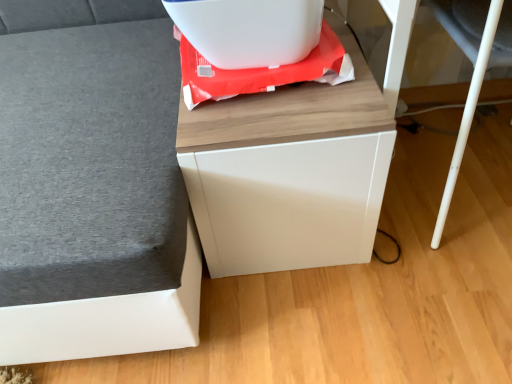
This screenshot has width=512, height=384. I want to click on matte gray sofa at left, the first furniture positioned from the left, so click(x=92, y=184).

Where is `white glossy cabinet at center, which appears as the second furniture when viewed from the left`? Image resolution: width=512 pixels, height=384 pixels. white glossy cabinet at center, which appears as the second furniture when viewed from the left is located at coordinates (289, 172).

This screenshot has width=512, height=384. What are the coordinates of `white plastic swivel chair at lower right` in the screenshot? It's located at (467, 116).

Describe the element at coordinates (249, 30) in the screenshot. This screenshot has width=512, height=384. I see `white plastic container at upper center` at that location.

I want to click on matte gray sofa at left, the first furniture positioned from the left, so click(x=92, y=184).

Is white plastic container at upper center a part of matte gray sofa at left, the first furniture positioned from the left?

No.

From a real-world perspective, is matte gray sofa at left, the first furniture positioned from the left, located higher than white plastic container at upper center?

Incorrect, from a real-world perspective, matte gray sofa at left, the first furniture positioned from the left, is lower than white plastic container at upper center.

Who is bigger, matte gray sofa at left, the second furniture positioned from the right, or white plastic container at upper center?

matte gray sofa at left, the second furniture positioned from the right, is bigger.

Find the location of a particular element. The width and height of the screenshot is (512, 384). appliance above the matte gray sofa at left, the first furniture positioned from the left (from a real-world perspective) is located at coordinates (249, 30).

How distant is white plastic swivel chair at lower right from matte gray sofa at left, the second furniture positioned from the right?

A distance of 29.80 inches exists between white plastic swivel chair at lower right and matte gray sofa at left, the second furniture positioned from the right.

Is white plastic swivel chair at lower right touching matte gray sofa at left, the second furniture positioned from the right?

white plastic swivel chair at lower right and matte gray sofa at left, the second furniture positioned from the right, are not in contact.

Between white plastic swivel chair at lower right and matte gray sofa at left, the second furniture positioned from the right, which one has more height?

matte gray sofa at left, the second furniture positioned from the right, is taller.

Considering their positions, is white plastic swivel chair at lower right located in front of or behind matte gray sofa at left, the first furniture positioned from the left?

white plastic swivel chair at lower right is positioned farther from the viewer than matte gray sofa at left, the first furniture positioned from the left.

Is white glossy cabinet at center, arranged as the first furniture when viewed from the right, next to white plastic swivel chair at lower right?

No, white glossy cabinet at center, arranged as the first furniture when viewed from the right, is not beside white plastic swivel chair at lower right.

Is white glossy cabinet at center, which appears as the second furniture when viewed from the left, behind white plastic swivel chair at lower right?

Yes.

Could you tell me if white glossy cabinet at center, which appears as the second furniture when viewed from the left, is facing white plastic swivel chair at lower right?

No, white glossy cabinet at center, which appears as the second furniture when viewed from the left, does not turn towards white plastic swivel chair at lower right.

Which is in front, white plastic container at upper center or white plastic swivel chair at lower right?

white plastic swivel chair at lower right is more forward.

Would you say white plastic container at upper center is outside white plastic swivel chair at lower right?

Yes, white plastic container at upper center is located beyond the bounds of white plastic swivel chair at lower right.

Is white plastic container at upper center smaller than white plastic swivel chair at lower right?

Yes.

Is white plastic container at upper center aimed at white plastic swivel chair at lower right?

No.

Is white glossy cabinet at center, arranged as the first furniture when viewed from the right, facing towards white plastic container at upper center?

No.

Considering the points (317, 97) and (290, 51), which point is behind, point (317, 97) or point (290, 51)?

Point (290, 51)

Measure the distance from white glossy cabinet at center, arranged as the first furniture when viewed from the right, to white plastic container at upper center.

white glossy cabinet at center, arranged as the first furniture when viewed from the right, and white plastic container at upper center are 8.90 inches apart.

How many degrees apart are the facing directions of white glossy cabinet at center, which appears as the second furniture when viewed from the left, and white plastic container at upper center?

white glossy cabinet at center, which appears as the second furniture when viewed from the left, and white plastic container at upper center are facing 93.6 degrees away from each other.

From the white plastic container at upper center, count 1st furnitures forward and point to it. Please provide its 2D coordinates.

[(289, 172)]

Between white plastic container at upper center and white glossy cabinet at center, arranged as the first furniture when viewed from the right, which one has smaller width?

white plastic container at upper center is thinner.

Is white plastic container at upper center oriented towards white glossy cabinet at center, which appears as the second furniture when viewed from the left?

No, white plastic container at upper center is not facing towards white glossy cabinet at center, which appears as the second furniture when viewed from the left.

From a real-world perspective, who is located higher, white plastic container at upper center or white glossy cabinet at center, which appears as the second furniture when viewed from the left?

white plastic container at upper center is physically above.

Is white plastic container at upper center facing towards matte gray sofa at left, the second furniture positioned from the right?

Yes, white plastic container at upper center is facing matte gray sofa at left, the second furniture positioned from the right.

Is white plastic container at upper center directly adjacent to matte gray sofa at left, the first furniture positioned from the left?

No.

You are a GUI agent. You are given a task and a screenshot of the screen. Output one action in this format:
    pyautogui.click(x=<x>, y=<y>)
    Task: Click on the appliance lying behind the matte gray sofa at left, the first furniture positioned from the left
    The width and height of the screenshot is (512, 384).
    Given the screenshot: What is the action you would take?
    pyautogui.click(x=249, y=30)

From a real-world perspective, starting from the white plastic container at upper center, which furniture is the 1st one below it? Please provide its 2D coordinates.

[(92, 184)]

Identify the location of the 2nd furniture counting from the left of the white plastic swivel chair at lower right. The width and height of the screenshot is (512, 384). (92, 184).

Looking at the image, which one is located further to white glossy cabinet at center, arranged as the first furniture when viewed from the right, white plastic swivel chair at lower right or white plastic container at upper center?

white plastic swivel chair at lower right is further to white glossy cabinet at center, arranged as the first furniture when viewed from the right.

Considering their positions, is matte gray sofa at left, the second furniture positioned from the right, positioned further to white plastic container at upper center than white plastic swivel chair at lower right?

white plastic swivel chair at lower right lies further to white plastic container at upper center than the other object.

Considering their positions, is white plastic container at upper center positioned closer to matte gray sofa at left, the first furniture positioned from the left, than white plastic swivel chair at lower right?

Based on the image, white plastic container at upper center appears to be nearer to matte gray sofa at left, the first furniture positioned from the left.

From the image, which object appears to be farther from white plastic container at upper center, matte gray sofa at left, the first furniture positioned from the left, or white glossy cabinet at center, arranged as the first furniture when viewed from the right?

matte gray sofa at left, the first furniture positioned from the left, lies further to white plastic container at upper center than the other object.

Looking at this image, looking at the image, which one is located closer to white glossy cabinet at center, which appears as the second furniture when viewed from the left, white plastic swivel chair at lower right or matte gray sofa at left, the first furniture positioned from the left?

Based on the image, matte gray sofa at left, the first furniture positioned from the left, appears to be nearer to white glossy cabinet at center, which appears as the second furniture when viewed from the left.

Looking at this image, which object lies nearer to the anchor point matte gray sofa at left, the second furniture positioned from the right, white plastic swivel chair at lower right or white glossy cabinet at center, which appears as the second furniture when viewed from the left?

white glossy cabinet at center, which appears as the second furniture when viewed from the left.

When comparing their distances from white plastic swivel chair at lower right, does matte gray sofa at left, the second furniture positioned from the right, or white plastic container at upper center seem closer?

white plastic container at upper center is closer to white plastic swivel chair at lower right.

Estimate the real-world distances between objects in this image. Which object is closer to white glossy cabinet at center, arranged as the first furniture when viewed from the right, white plastic container at upper center or white plastic swivel chair at lower right?

white plastic container at upper center.

Where is `appliance situated between matte gray sofa at left, the second furniture positioned from the right, and white glossy cabinet at center, arranged as the first furniture when viewed from the right, from left to right`? The width and height of the screenshot is (512, 384). appliance situated between matte gray sofa at left, the second furniture positioned from the right, and white glossy cabinet at center, arranged as the first furniture when viewed from the right, from left to right is located at coordinates click(249, 30).

Find the location of a particular element. The width and height of the screenshot is (512, 384). furniture between matte gray sofa at left, the second furniture positioned from the right, and white plastic swivel chair at lower right is located at coordinates (x=289, y=172).

Identify the location of appliance between matte gray sofa at left, the first furniture positioned from the left, and white plastic swivel chair at lower right from left to right. (249, 30).

What are the coordinates of `furniture located between white plastic container at upper center and white plastic swivel chair at lower right in the left-right direction` in the screenshot? It's located at (289, 172).